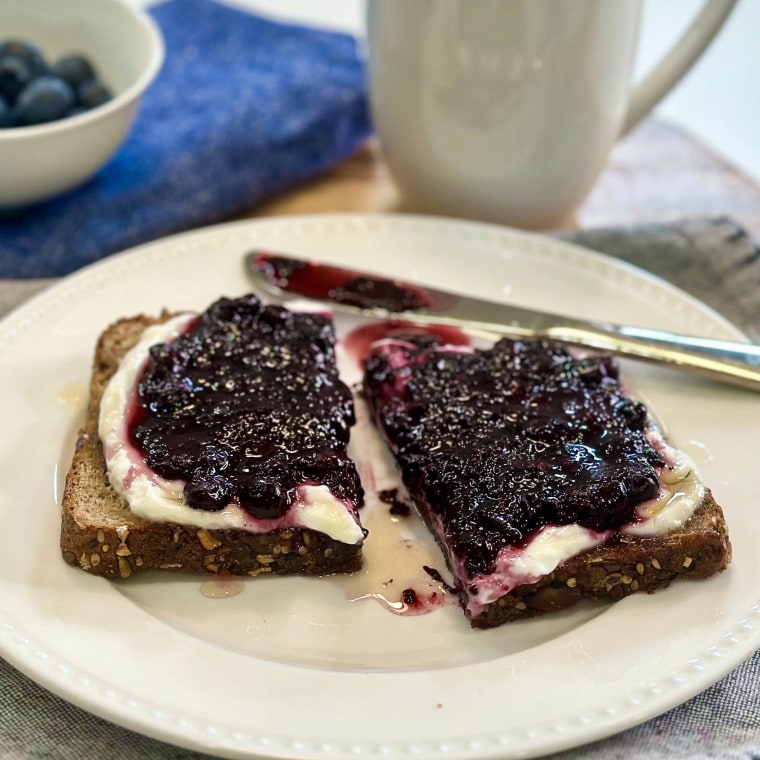
Image resolution: width=760 pixels, height=760 pixels. I want to click on plate, so click(496, 714).